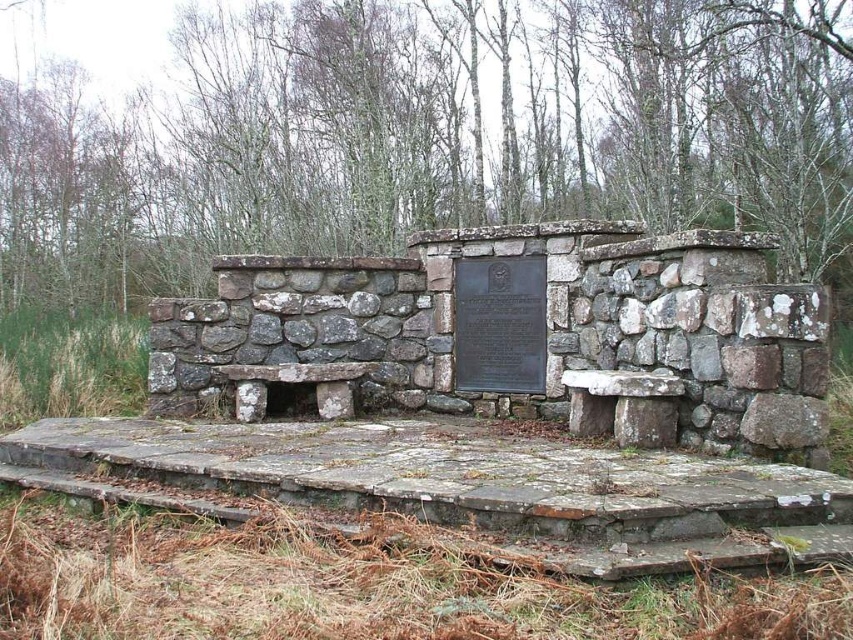
Question: Does rustic stone bench at center have a lesser width compared to bronze plaque at center?

Choices:
 (A) no
 (B) yes

Answer: (A)

Question: Can you confirm if rustic stone bench at center is positioned to the right of bronze plaque at center?

Choices:
 (A) no
 (B) yes

Answer: (A)

Question: Which object is closer to the camera taking this photo?

Choices:
 (A) rustic stone bench at center
 (B) bronze plaque at center

Answer: (A)

Question: Does rustic stone bench at center come in front of bronze plaque at center?

Choices:
 (A) no
 (B) yes

Answer: (B)